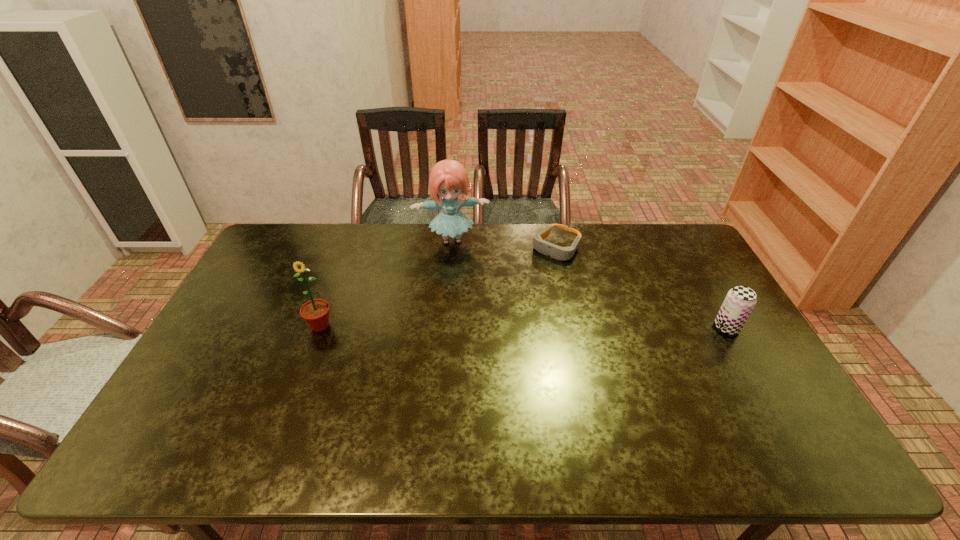
Find the location of a particular element. Image resolution: width=960 pixels, height=540 pixels. vacant space on the desktop that is between the leftmost object and the rightmost object and is positioned on the front and back of the goggles is located at coordinates (484, 326).

The height and width of the screenshot is (540, 960). What are the coordinates of `free space on the desktop that is between the leftmost object and the second shortest object and is positioned on the front-facing side of the tallest object` in the screenshot? It's located at (466, 326).